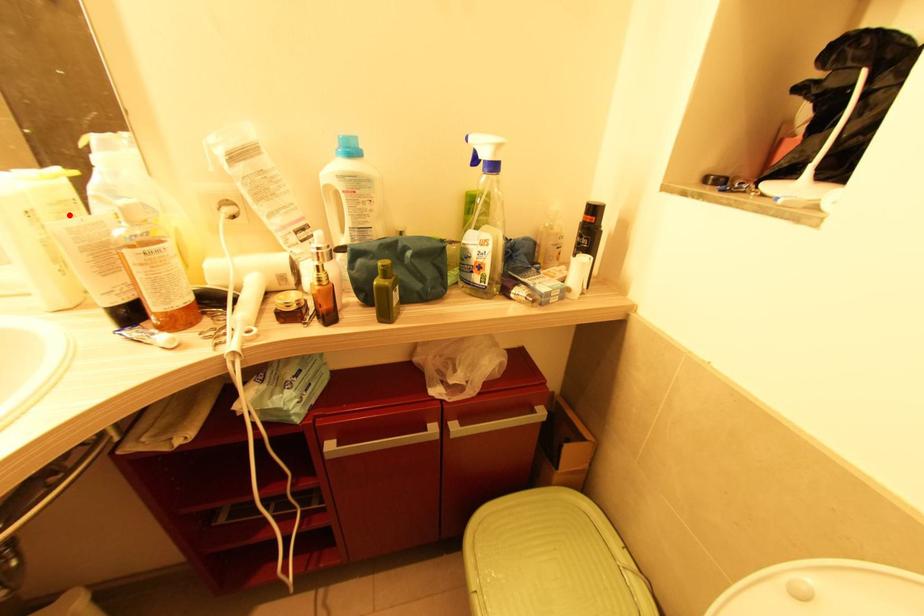
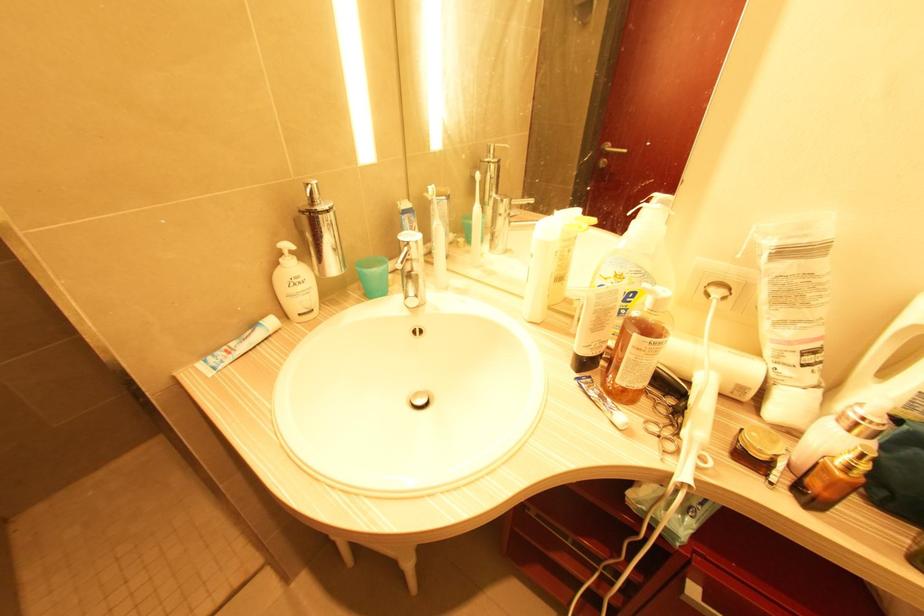
Find the pixel in the second image that matches the highlighted location in the first image.

(569, 249)